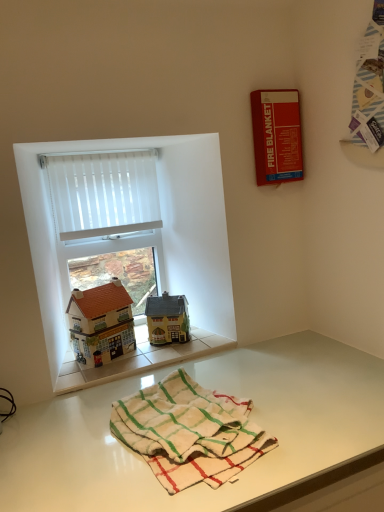
This screenshot has width=384, height=512. Find the location of `white glossy table at lower center`. white glossy table at lower center is located at coordinates (207, 388).

The image size is (384, 512). Describe the element at coordinates (167, 319) in the screenshot. I see `matte yellow house at center, which ranks as the first toy in right-to-left order` at that location.

What is the approximate width of matte yellow house at center, the 2th toy positioned from the left?

matte yellow house at center, the 2th toy positioned from the left, is 4.40 inches in width.

Describe the element at coordinates (276, 136) in the screenshot. I see `red matte fire blanket at upper right` at that location.

Identify the location of white cotton bath towel at lower center. This screenshot has height=512, width=384. (189, 432).

Image resolution: width=384 pixels, height=512 pixels. What do you see at coordinates (103, 193) in the screenshot? I see `white sheer curtain at upper left` at bounding box center [103, 193].

Locate an element on the screen. This screenshot has width=384, height=512. white glossy table at lower center is located at coordinates (207, 388).

Between point (146, 206) and point (76, 160), which one is positioned in front?

The point (76, 160) is closer to the camera.

This screenshot has height=512, width=384. Identify the location of curtain above the white vertical blinds at upper left (from the image's perspective). (103, 193).

From the image's perspective, would you say white sheer curtain at upper left is positioned over white vertical blinds at upper left?

Yes, from the image's perspective, white sheer curtain at upper left is over white vertical blinds at upper left.

From a real-world perspective, which is physically below, white glossy table at lower center or white cotton bath towel at lower center?

white glossy table at lower center, from a real-world perspective.

Can you see white glossy table at lower center touching white cotton bath towel at lower center?

No, white glossy table at lower center is not making contact with white cotton bath towel at lower center.

Is white glossy table at lower center positioned before white cotton bath towel at lower center?

Yes, white glossy table at lower center is in front of white cotton bath towel at lower center.

Between white sheer curtain at upper left and red matte fire blanket at upper right, which one has more height?

red matte fire blanket at upper right.

Is white sheer curtain at upper left bigger or smaller than red matte fire blanket at upper right?

In the image, white sheer curtain at upper left appears to be larger than red matte fire blanket at upper right.

From the image's perspective, which object appears higher, white sheer curtain at upper left or red matte fire blanket at upper right?

From the image's view, red matte fire blanket at upper right is above.

From a real-world perspective, is white sheer curtain at upper left physically located above or below red matte fire blanket at upper right?

In terms of real-world spatial position, white sheer curtain at upper left is below red matte fire blanket at upper right.

Does white sheer curtain at upper left have a lesser width compared to matte yellow house at center, the 2th toy positioned from the left?

Indeed, white sheer curtain at upper left has a lesser width compared to matte yellow house at center, the 2th toy positioned from the left.

From a real-world perspective, between white sheer curtain at upper left and matte yellow house at center, which ranks as the first toy in right-to-left order, who is vertically higher?

white sheer curtain at upper left, from a real-world perspective.

Between white sheer curtain at upper left and matte yellow house at center, which ranks as the first toy in right-to-left order, which one is positioned in front?

Positioned in front is matte yellow house at center, which ranks as the first toy in right-to-left order.

Can you confirm if red matte fire blanket at upper right is thinner than white cotton bath towel at lower center?

Indeed, red matte fire blanket at upper right has a lesser width compared to white cotton bath towel at lower center.

Measure the distance between red matte fire blanket at upper right and white cotton bath towel at lower center.

red matte fire blanket at upper right and white cotton bath towel at lower center are 79.30 centimeters apart.

Is there a large distance between red matte fire blanket at upper right and white cotton bath towel at lower center?

That's not correct — red matte fire blanket at upper right is a little close to white cotton bath towel at lower center.

Which object is more forward, red matte fire blanket at upper right or white cotton bath towel at lower center?

white cotton bath towel at lower center is in front.

Measure the distance between matte yellow house at center, the 2th toy positioned from the left, and white glossy table at lower center.

44.12 centimeters.

From the picture: Can you confirm if matte yellow house at center, the 2th toy positioned from the left, is taller than white glossy table at lower center?

No, matte yellow house at center, the 2th toy positioned from the left, is not taller than white glossy table at lower center.

Is matte yellow house at center, the 2th toy positioned from the left, spatially inside white glossy table at lower center, or outside of it?

matte yellow house at center, the 2th toy positioned from the left, is located beyond the bounds of white glossy table at lower center.

Is matte yellow house at center, the 2th toy positioned from the left, in front of or behind white glossy table at lower center in the image?

matte yellow house at center, the 2th toy positioned from the left, is positioned farther from the viewer than white glossy table at lower center.

Is white sheer curtain at upper left turned away from matte brown house at left, the 1th toy from the left?

No, white sheer curtain at upper left is not facing the opposite direction of matte brown house at left, the 1th toy from the left.

Locate an element on the screen. This screenshot has width=384, height=512. toy that is the 2nd one when counting forward from the white sheer curtain at upper left is located at coordinates (101, 322).

Is white sheer curtain at upper left located outside matte brown house at left, the 1th toy from the left?

Yes.

From a real-world perspective, between white sheer curtain at upper left and matte brown house at left, the 1th toy from the left, who is vertically higher?

white sheer curtain at upper left, from a real-world perspective.

I want to click on window below the white sheer curtain at upper left (from the image's perspective), so pos(101,201).

Locate an element on the screen. bath towel above the white glossy table at lower center (from a real-world perspective) is located at coordinates (189, 432).

Which object lies further to the anchor point matte brown house at left, the 1th toy from the left, white vertical blinds at upper left or red matte fire blanket at upper right?

Among the two, red matte fire blanket at upper right is located further to matte brown house at left, the 1th toy from the left.

Based on the photo, when comparing their distances from matte yellow house at center, which ranks as the first toy in right-to-left order, does red matte fire blanket at upper right or matte brown house at left, the second toy viewed from the right, seem further?

red matte fire blanket at upper right.

Considering their positions, is white sheer curtain at upper left positioned further to matte yellow house at center, the 2th toy positioned from the left, than matte brown house at left, the second toy viewed from the right?

white sheer curtain at upper left lies further to matte yellow house at center, the 2th toy positioned from the left, than the other object.

Based on their spatial positions, is white sheer curtain at upper left or white glossy table at lower center closer to matte brown house at left, the second toy viewed from the right?

Among the two, white sheer curtain at upper left is located nearer to matte brown house at left, the second toy viewed from the right.

Considering their positions, is white glossy table at lower center positioned closer to white sheer curtain at upper left than white cotton bath towel at lower center?

The object closer to white sheer curtain at upper left is white glossy table at lower center.

Consider the image. Based on their spatial positions, is white cotton bath towel at lower center or white sheer curtain at upper left closer to white glossy table at lower center?

Based on the image, white cotton bath towel at lower center appears to be nearer to white glossy table at lower center.

Looking at the image, which one is located closer to matte brown house at left, the second toy viewed from the right, red matte fire blanket at upper right or matte yellow house at center, the 2th toy positioned from the left?

matte yellow house at center, the 2th toy positioned from the left, is positioned closer to the anchor matte brown house at left, the second toy viewed from the right.

Based on their spatial positions, is white cotton bath towel at lower center or red matte fire blanket at upper right closer to white vertical blinds at upper left?

The object closer to white vertical blinds at upper left is red matte fire blanket at upper right.

Where is `window between white sheer curtain at upper left and white glossy table at lower center from top to bottom`? window between white sheer curtain at upper left and white glossy table at lower center from top to bottom is located at coordinates (101, 201).

The image size is (384, 512). Find the location of `bath towel between red matte fire blanket at upper right and white glossy table at lower center vertically`. bath towel between red matte fire blanket at upper right and white glossy table at lower center vertically is located at coordinates (189, 432).

Identify the location of toy that lies between white sheer curtain at upper left and matte yellow house at center, which ranks as the first toy in right-to-left order, from top to bottom. The image size is (384, 512). (101, 322).

This screenshot has height=512, width=384. What are the coordinates of `toy between white cotton bath towel at lower center and matte yellow house at center, the 2th toy positioned from the left, from front to back` in the screenshot? It's located at (101, 322).